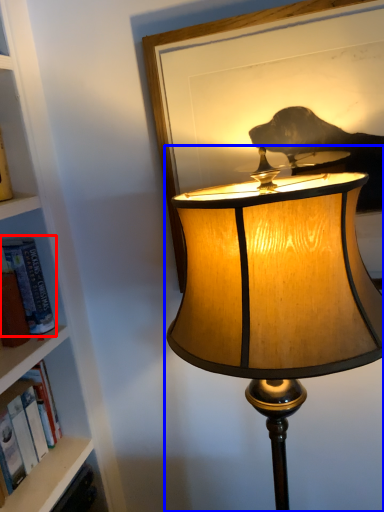
Question: Which object appears closest to the camera in this image, book (highlighted by a red box) or lamp (highlighted by a blue box)?

Choices:
 (A) book
 (B) lamp

Answer: (B)